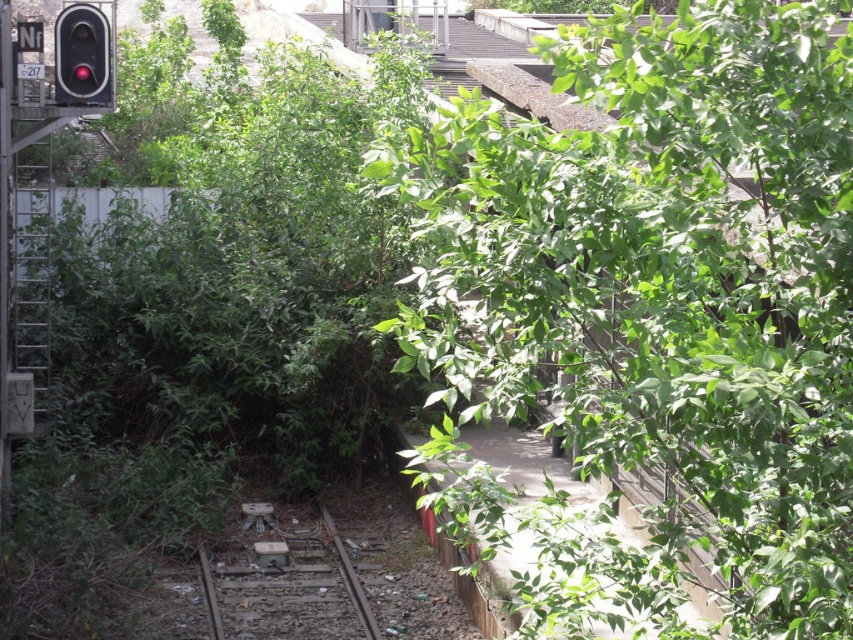
Question: Which point is farther from the camera taking this photo?

Choices:
 (A) (57, 28)
 (B) (257, 605)
 (C) (833, 161)

Answer: (A)

Question: Is green leafy tree at upper right above metallic red traffic light at upper left?

Choices:
 (A) yes
 (B) no

Answer: (B)

Question: Does green leafy tree at upper right appear over metallic red traffic light at upper left?

Choices:
 (A) yes
 (B) no

Answer: (B)

Question: Which object is the farthest from the metallic red traffic light at upper left?

Choices:
 (A) green leafy tree at upper right
 (B) dull metallic train track at center

Answer: (A)

Question: Estimate the real-world distances between objects in this image. Which object is farther from the dull metallic train track at center?

Choices:
 (A) green leafy tree at upper right
 (B) metallic red traffic light at upper left

Answer: (A)

Question: Does dull metallic train track at center appear under metallic red traffic light at upper left?

Choices:
 (A) yes
 (B) no

Answer: (A)